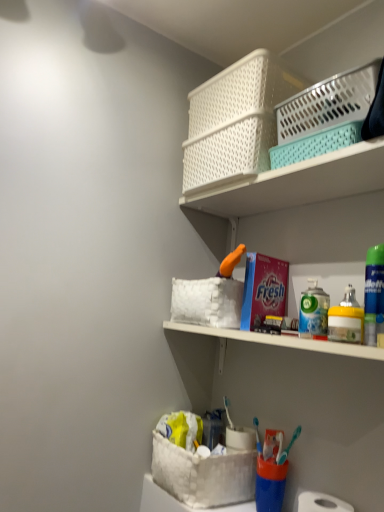
Question: Is yellow matte spray can at right situated inside metallic silver mouthwash at shelf right, which appears as the 1th mouthwash when viewed from the left, or outside?

Choices:
 (A) inside
 (B) outside

Answer: (B)

Question: Considering their positions, is yellow matte spray can at right located in front of or behind metallic silver mouthwash at shelf right, which ranks as the 2th mouthwash in front-to-back order?

Choices:
 (A) front
 (B) behind

Answer: (A)

Question: Which is nearer to the matte red detergent at center?

Choices:
 (A) white fabric basket at lower center, which is counted as the 3th basket container, starting from the top
 (B) white plastic basket at upper center
 (C) green plastic mouthwash at right, positioned as the first mouthwash in right-to-left order
 (D) yellow matte spray can at right
 (E) metallic silver mouthwash at shelf right, which ranks as the 2th mouthwash in right-to-left order

Answer: (E)

Question: Which object is the farthest from the metallic silver mouthwash at shelf right, the 1th mouthwash in the back-to-front sequence?

Choices:
 (A) yellow matte spray can at right
 (B) white woven basket at upper center, the third basket container in the bottom-to-top sequence
 (C) white plastic basket at upper right, positioned as the 2th basket container in top-to-bottom order
 (D) white fabric basket at lower center, the first basket container in the bottom-to-top sequence
 (E) matte red detergent at center

Answer: (B)